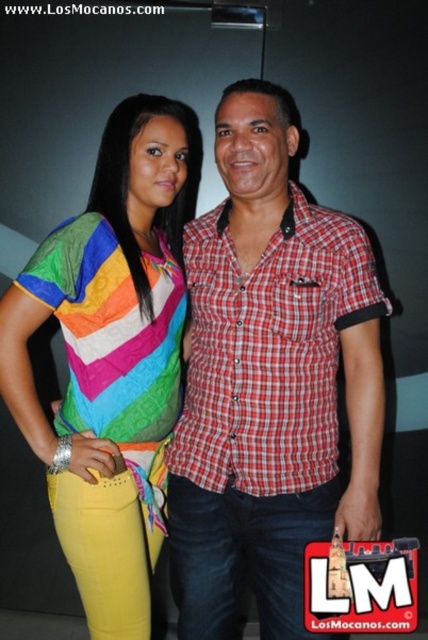
Who is lower down, red checkered shirt at center or rainbow fabric shirt at center?

rainbow fabric shirt at center is below.

Is point (261, 376) less distant than point (122, 186)?

Yes.

The image size is (428, 640). Find the location of `red checkered shirt at center`. red checkered shirt at center is located at coordinates (270, 381).

This screenshot has width=428, height=640. What are the coordinates of `red checkered shirt at center` in the screenshot? It's located at (270, 381).